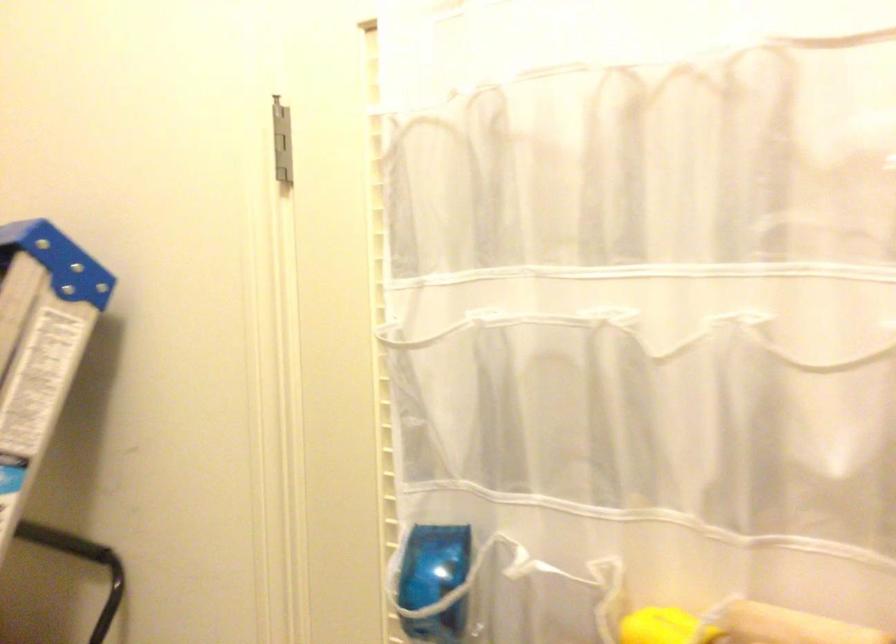
Find where to grasp the black ladder handle. Please return your answer as a coordinate pair (x, y).

(82, 565)